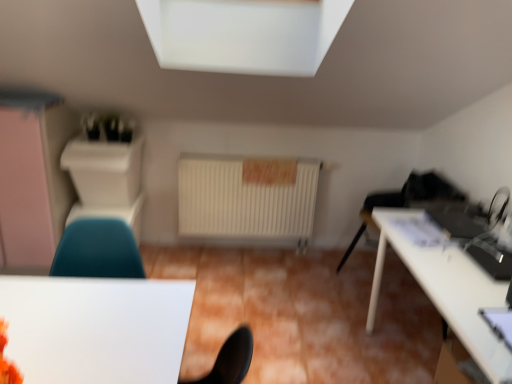
Measure the distance between point [2,259] and camera.

The distance of point [2,259] from camera is 2.66 meters.

What do you see at coordinates (97, 250) in the screenshot? The image size is (512, 384). I see `teal fabric chair at lower left` at bounding box center [97, 250].

In order to click on teal fabric chair at lower left in this screenshot , I will do `click(97, 250)`.

Locate an element on the screen. This screenshot has width=512, height=384. matte white dresser at left is located at coordinates (34, 183).

In the image, there is a white glossy table at right, the second table positioned from the left. At what (x,y) coordinates should I click in order to perform the action: click on chair above it (from the image's perspective). Please return your answer as a coordinate pair (x, y). Image resolution: width=512 pixels, height=384 pixels. Looking at the image, I should click on (97, 250).

Does white glossy table at right, the second table positioned from the left, lie behind teal fabric chair at lower left?

No, white glossy table at right, the second table positioned from the left, is closer to the viewer.

Is white glossy table at right, the second table positioned from the left, completely or partially outside of teal fabric chair at lower left?

white glossy table at right, the second table positioned from the left, is positioned outside teal fabric chair at lower left.

Could you measure the distance between white glossy table at right, which appears as the 1th table when viewed from the right, and teal fabric chair at lower left?

A distance of 4.21 feet exists between white glossy table at right, which appears as the 1th table when viewed from the right, and teal fabric chair at lower left.

From the image's perspective, is white glossy table at right, the second table positioned from the left, located above or below matte white dresser at left?

Based on their image positions, white glossy table at right, the second table positioned from the left, is located beneath matte white dresser at left.

Is point (379, 259) more distant than point (41, 129)?

That is False.

Is white glossy table at right, the second table positioned from the left, directly adjacent to matte white dresser at left?

No, white glossy table at right, the second table positioned from the left, is not touching matte white dresser at left.

Is white glossy table at right, which appears as the 1th table when viewed from the right, oriented towards matte white dresser at left?

Yes, white glossy table at right, which appears as the 1th table when viewed from the right, is facing matte white dresser at left.

Between white glossy table at lower left, which ranks as the 1th table in left-to-right order, and white glossy table at right, which appears as the 1th table when viewed from the right, which one is positioned in front?

Positioned in front is white glossy table at lower left, which ranks as the 1th table in left-to-right order.

Which of these two, white glossy table at lower left, the 2th table from the right, or white glossy table at right, which appears as the 1th table when viewed from the right, is smaller?

Smaller between the two is white glossy table at lower left, the 2th table from the right.

Is point (116, 237) less distant than point (156, 297)?

No, (116, 237) is further to viewer.

Considering the positions of objects teal fabric chair at lower left and white glossy table at lower left, which ranks as the 1th table in left-to-right order, in the image provided, who is more to the left, teal fabric chair at lower left or white glossy table at lower left, which ranks as the 1th table in left-to-right order,?

teal fabric chair at lower left is more to the left.

Which object is thinner, teal fabric chair at lower left or white glossy table at lower left, which ranks as the 1th table in left-to-right order?

With smaller width is teal fabric chair at lower left.

Which of these two, teal fabric chair at lower left or white glossy table at lower left, the 2th table from the right, is bigger?

teal fabric chair at lower left is bigger.

From the image's perspective, which one is positioned lower, white glossy table at lower left, which ranks as the 1th table in left-to-right order, or teal fabric chair at lower left?

white glossy table at lower left, which ranks as the 1th table in left-to-right order, is shown below in the image.

In terms of width, does white glossy table at lower left, which ranks as the 1th table in left-to-right order, look wider or thinner when compared to teal fabric chair at lower left?

white glossy table at lower left, which ranks as the 1th table in left-to-right order, is wider than teal fabric chair at lower left.

Can we say white glossy table at lower left, the 2th table from the right, lies outside teal fabric chair at lower left?

Yes, white glossy table at lower left, the 2th table from the right, is not within teal fabric chair at lower left.

Is the depth of white glossy table at lower left, the 2th table from the right, less than that of teal fabric chair at lower left?

Yes, the depth of white glossy table at lower left, the 2th table from the right, is less than that of teal fabric chair at lower left.

Is matte white dresser at left facing away from white glossy table at lower left, the 2th table from the right?

No, matte white dresser at left is not facing the opposite direction of white glossy table at lower left, the 2th table from the right.

Considering the positions of objects matte white dresser at left and white glossy table at lower left, the 2th table from the right, in the image provided, who is more to the right, matte white dresser at left or white glossy table at lower left, the 2th table from the right,?

white glossy table at lower left, the 2th table from the right, is more to the right.

Is matte white dresser at left next to white glossy table at lower left, which ranks as the 1th table in left-to-right order, and touching it?

matte white dresser at left and white glossy table at lower left, which ranks as the 1th table in left-to-right order, are not in contact.

Consider the image. Between teal fabric chair at lower left and white glossy table at right, the second table positioned from the left, which one appears on the left side from the viewer's perspective?

Positioned to the left is teal fabric chair at lower left.

Can you see teal fabric chair at lower left touching white glossy table at right, which appears as the 1th table when viewed from the right?

teal fabric chair at lower left is not next to white glossy table at right, which appears as the 1th table when viewed from the right, and they're not touching.

Is white glossy table at right, which appears as the 1th table when viewed from the right, inside teal fabric chair at lower left?

No.

Based on the photo, from the image's perspective, is teal fabric chair at lower left above white glossy table at right, which appears as the 1th table when viewed from the right?

Yes, from the image's perspective, teal fabric chair at lower left is above white glossy table at right, which appears as the 1th table when viewed from the right.

The height and width of the screenshot is (384, 512). What are the coordinates of `chair lying behind the white glossy table at right, which appears as the 1th table when viewed from the right` in the screenshot? It's located at (97, 250).

I want to click on dresser located above the white glossy table at right, which appears as the 1th table when viewed from the right (from the image's perspective), so click(34, 183).

When comparing their distances from matte white dresser at left, does white glossy table at right, the second table positioned from the left, or teal fabric chair at lower left seem further?

white glossy table at right, the second table positioned from the left, is further to matte white dresser at left.

From the picture: Estimate the real-world distances between objects in this image. Which object is closer to teal fabric chair at lower left, white glossy table at lower left, which ranks as the 1th table in left-to-right order, or white glossy table at right, the second table positioned from the left?

white glossy table at lower left, which ranks as the 1th table in left-to-right order.

From the image, which object appears to be farther from white glossy table at lower left, which ranks as the 1th table in left-to-right order, white glossy table at right, the second table positioned from the left, or matte white dresser at left?

matte white dresser at left.

Estimate the real-world distances between objects in this image. Which object is closer to white glossy table at lower left, the 2th table from the right, matte white dresser at left or white glossy table at right, which appears as the 1th table when viewed from the right?

white glossy table at right, which appears as the 1th table when viewed from the right, lies closer to white glossy table at lower left, the 2th table from the right, than the other object.

Estimate the real-world distances between objects in this image. Which object is closer to white glossy table at lower left, which ranks as the 1th table in left-to-right order, teal fabric chair at lower left or white glossy table at right, the second table positioned from the left?

teal fabric chair at lower left lies closer to white glossy table at lower left, which ranks as the 1th table in left-to-right order, than the other object.

Based on their spatial positions, is teal fabric chair at lower left or matte white dresser at left closer to white glossy table at right, the second table positioned from the left?

teal fabric chair at lower left.

Estimate the real-world distances between objects in this image. Which object is further from white glossy table at lower left, which ranks as the 1th table in left-to-right order, white glossy table at right, the second table positioned from the left, or teal fabric chair at lower left?

Among the two, white glossy table at right, the second table positioned from the left, is located further to white glossy table at lower left, which ranks as the 1th table in left-to-right order.

When comparing their distances from teal fabric chair at lower left, does white glossy table at lower left, the 2th table from the right, or matte white dresser at left seem further?

matte white dresser at left.

Locate an element on the screen. Image resolution: width=512 pixels, height=384 pixels. table between matte white dresser at left and white glossy table at right, the second table positioned from the left is located at coordinates (96, 328).

Identify the location of table between teal fabric chair at lower left and white glossy table at right, the second table positioned from the left, from left to right. This screenshot has height=384, width=512. (96, 328).

Find the location of a particular element. dresser between white glossy table at lower left, which ranks as the 1th table in left-to-right order, and teal fabric chair at lower left in the front-back direction is located at coordinates (34, 183).

The height and width of the screenshot is (384, 512). I want to click on chair between matte white dresser at left and white glossy table at right, which appears as the 1th table when viewed from the right, in the horizontal direction, so click(97, 250).